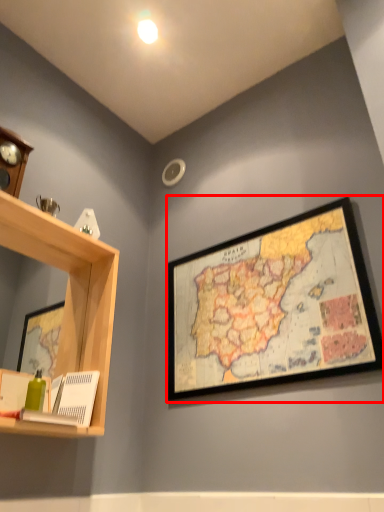
Question: From the image's perspective, where is picture frame (annotated by the red box) located relative to shelf?

Choices:
 (A) above
 (B) below

Answer: (A)